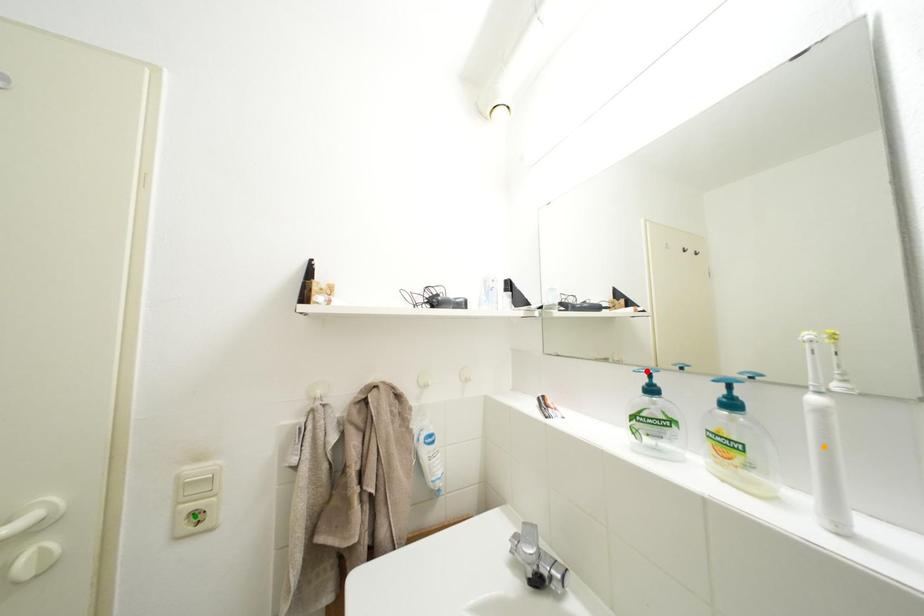
Order these from nearest to farthest:
green point, orange point, red point

red point
green point
orange point